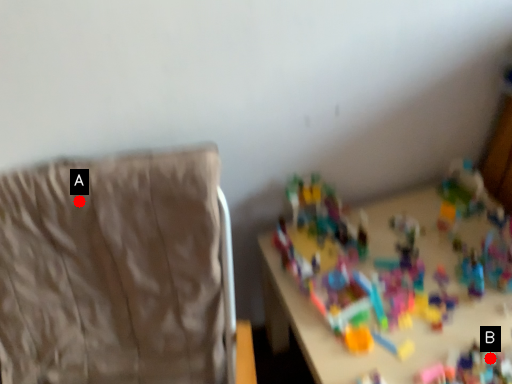
Question: Two points are circled on the image, labeled by A and B beside each circle. Among these points, which one is nearest to the camera?

Choices:
 (A) A is closer
 (B) B is closer

Answer: (A)